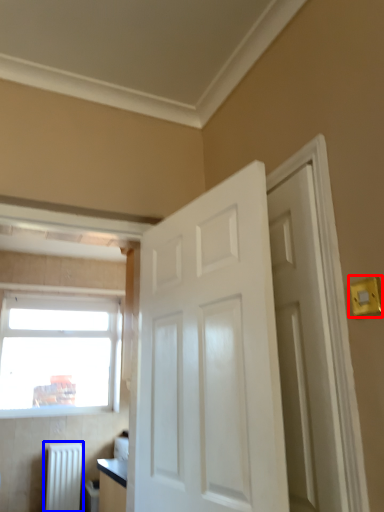
Question: Among these objects, which one is nearest to the camera, light switch (highlighted by a red box) or radiator (highlighted by a blue box)?

Choices:
 (A) light switch
 (B) radiator

Answer: (A)